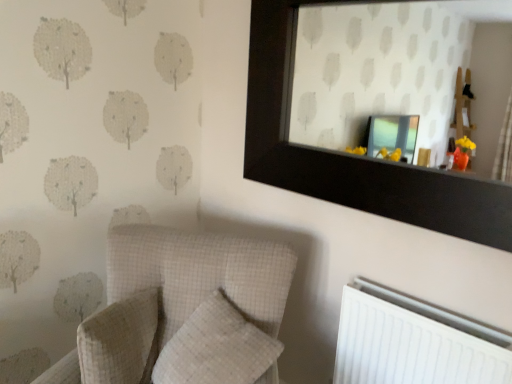
Question: Is white plastic radiator at lower right far away from white checkered pillow at lower left, the 1th pillow when ordered from left to right?

Choices:
 (A) no
 (B) yes

Answer: (A)

Question: Is white plastic radiator at lower right touching white checkered pillow at lower left, the second pillow in the right-to-left sequence?

Choices:
 (A) yes
 (B) no

Answer: (B)

Question: Considering the relative sizes of white plastic radiator at lower right and white checkered pillow at lower left, the second pillow in the right-to-left sequence, in the image provided, is white plastic radiator at lower right thinner than white checkered pillow at lower left, the second pillow in the right-to-left sequence,?

Choices:
 (A) no
 (B) yes

Answer: (B)

Question: Can we say white plastic radiator at lower right lies outside white checkered pillow at lower left, the 1th pillow when ordered from left to right?

Choices:
 (A) no
 (B) yes

Answer: (B)

Question: From a real-world perspective, is white plastic radiator at lower right on white checkered pillow at lower left, the second pillow in the right-to-left sequence?

Choices:
 (A) yes
 (B) no

Answer: (B)

Question: In terms of height, does white checkered pillow at center, the first pillow viewed from the right, look taller or shorter compared to black wooden mirror at upper center?

Choices:
 (A) tall
 (B) short

Answer: (B)

Question: Is white checkered pillow at center, the first pillow viewed from the right, in front of or behind black wooden mirror at upper center in the image?

Choices:
 (A) front
 (B) behind

Answer: (B)

Question: In terms of size, does white checkered pillow at center, which is counted as the 2th pillow, starting from the left, appear bigger or smaller than black wooden mirror at upper center?

Choices:
 (A) small
 (B) big

Answer: (A)

Question: From the image's perspective, is white checkered pillow at center, the first pillow viewed from the right, positioned above or below black wooden mirror at upper center?

Choices:
 (A) below
 (B) above

Answer: (A)

Question: Is point (100, 322) positioned closer to the camera than point (203, 347)?

Choices:
 (A) farther
 (B) closer

Answer: (B)

Question: From the image's perspective, is white checkered pillow at lower left, the 1th pillow when ordered from left to right, located above or below white checkered pillow at center, which is counted as the 2th pillow, starting from the left?

Choices:
 (A) above
 (B) below

Answer: (A)

Question: Considering the relative positions of white checkered pillow at lower left, the second pillow in the right-to-left sequence, and white checkered pillow at center, which is counted as the 2th pillow, starting from the left, in the image provided, is white checkered pillow at lower left, the second pillow in the right-to-left sequence, to the left or to the right of white checkered pillow at center, which is counted as the 2th pillow, starting from the left,?

Choices:
 (A) left
 (B) right

Answer: (A)

Question: Is white checkered pillow at lower left, the second pillow in the right-to-left sequence, taller or shorter than white checkered pillow at center, the first pillow viewed from the right?

Choices:
 (A) tall
 (B) short

Answer: (A)

Question: Considering the positions of point (128, 327) and point (366, 94), is point (128, 327) closer or farther from the camera than point (366, 94)?

Choices:
 (A) closer
 (B) farther

Answer: (A)

Question: From the image's perspective, is white checkered pillow at lower left, the 1th pillow when ordered from left to right, located above or below black wooden mirror at upper center?

Choices:
 (A) below
 (B) above

Answer: (A)